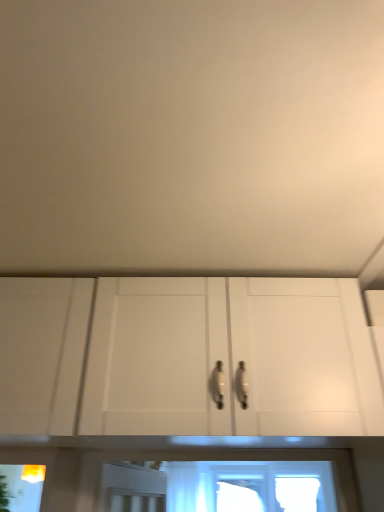
Question: Is point (1, 475) positioned closer to the camera than point (175, 372)?

Choices:
 (A) closer
 (B) farther

Answer: (B)

Question: Considering the positions of green leafy plant at lower left and white matte cabinet at center in the image, is green leafy plant at lower left bigger or smaller than white matte cabinet at center?

Choices:
 (A) small
 (B) big

Answer: (A)

Question: Estimate the real-world distances between objects in this image. Which object is closer to the yellow plastic light fixture at lower left?

Choices:
 (A) white matte cabinet at center
 (B) green leafy plant at lower left

Answer: (B)

Question: Which of these objects is positioned farthest from the green leafy plant at lower left?

Choices:
 (A) yellow plastic light fixture at lower left
 (B) white matte cabinet at center

Answer: (B)